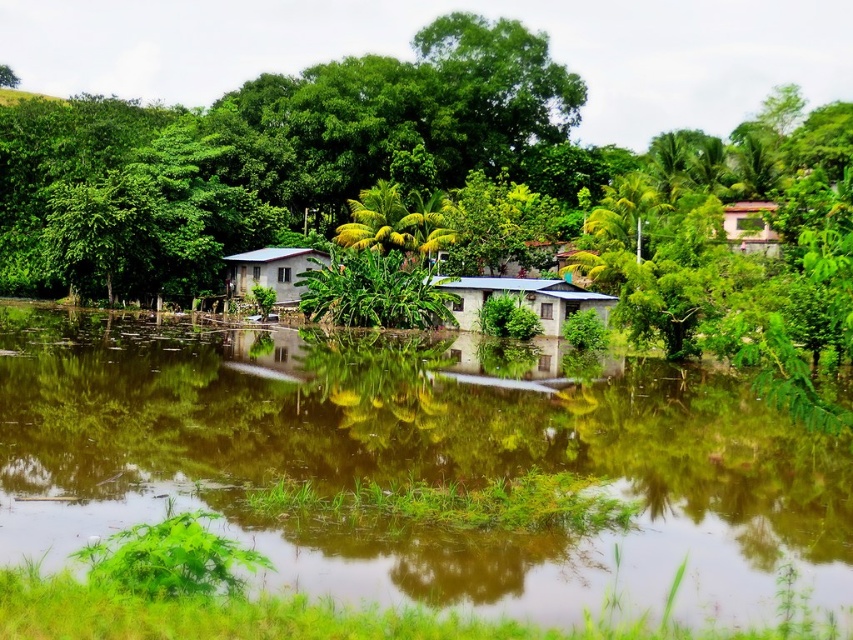
You are planning to host a small gathering and need to choose between the matte blue hut at center and the pink matte hut at upper right for more guests. Which one can accommodate more people based on their sizes?

The matte blue hut at center has a larger size compared to the pink matte hut at upper right, so it can accommodate more people.

You are a photographer planning to capture the entire white corrugated metal hut at center and brown reflective water at center in a single frame. Based on the scene, which object will require you to adjust your camera angle to include its full width?

The brown reflective water at center has a greater width than the white corrugated metal hut at center, so you will need to adjust your camera angle to include the full width of the brown reflective water at center.

You are standing at the point with coordinates point (575, 285) and want to see the point with coordinates point (662, 588). Can you see it directly without any obstruction?

Point (662, 588) is in front of point (575, 285), so yes, you can see it directly without any obstruction.